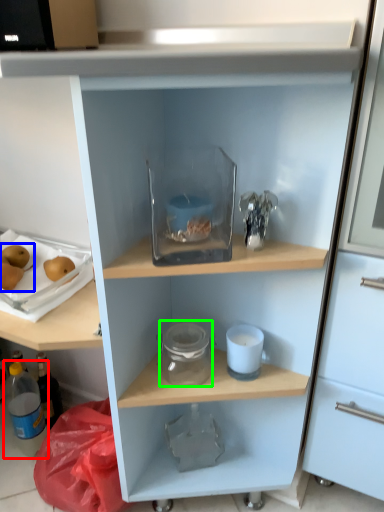
Question: Based on their relative distances, which object is nearer to bottle (highlighted by a red box)? Choose from fruit (highlighted by a blue box) and glass jar (highlighted by a green box).

Choices:
 (A) fruit
 (B) glass jar

Answer: (A)